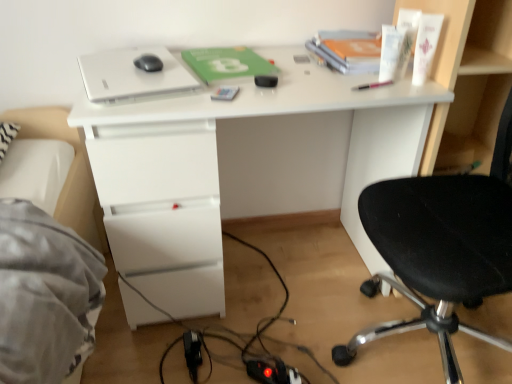
Where is `white matte book at upper right`? This screenshot has width=512, height=384. white matte book at upper right is located at coordinates (348, 50).

Locate an element on the screen. white glossy desk at center is located at coordinates (240, 166).

Identify the location of black fabric chair at right. (441, 248).

Measure the distance between black fabric chair at right and camera.

black fabric chair at right is 32.70 inches from camera.

Image resolution: width=512 pixels, height=384 pixels. What do you see at coordinates (225, 93) in the screenshot? I see `metallic silver phone at center, the first stationery from the left` at bounding box center [225, 93].

Locate an element on the screen. The width and height of the screenshot is (512, 384). pink plastic pen at upper right, which is the second stationery from left to right is located at coordinates (373, 85).

The image size is (512, 384). What do you see at coordinates (373, 85) in the screenshot? I see `pink plastic pen at upper right, positioned as the 1th stationery in right-to-left order` at bounding box center [373, 85].

In order to click on black matte mouse at upper center in this screenshot , I will do `click(148, 63)`.

Image resolution: width=512 pixels, height=384 pixels. I want to click on white matte book at upper right, so click(x=348, y=50).

Is white matte laptop at upper center in front of or behind metallic silver phone at center, positioned as the 2th stationery in right-to-left order, in the image?

Visually, white matte laptop at upper center is located in front of metallic silver phone at center, positioned as the 2th stationery in right-to-left order.

Between point (150, 54) and point (230, 95), which one is positioned in front?

The point (230, 95) is in front.

Considering the sizes of objects white matte laptop at upper center and metallic silver phone at center, positioned as the 2th stationery in right-to-left order, in the image provided, who is bigger, white matte laptop at upper center or metallic silver phone at center, positioned as the 2th stationery in right-to-left order,?

white matte laptop at upper center is bigger.

What's the angular difference between white matte laptop at upper center and metallic silver phone at center, the first stationery from the left,'s facing directions?

34.7 degrees separate the facing orientations of white matte laptop at upper center and metallic silver phone at center, the first stationery from the left.

How many degrees apart are the facing directions of black matte mouse at upper center and green matte paperback book at center?

The angle between the facing direction of black matte mouse at upper center and the facing direction of green matte paperback book at center is 15.2 degrees.

Is black matte mouse at upper center shorter than green matte paperback book at center?

No.

Is black matte mouse at upper center spatially inside green matte paperback book at center, or outside of it?

black matte mouse at upper center cannot be found inside green matte paperback book at center.

From the image's perspective, is black matte mouse at upper center positioned above or below green matte paperback book at center?

From the image's perspective, black matte mouse at upper center appears below green matte paperback book at center.

From the picture: Considering the relative sizes of black fabric chair at right and black matte mouse at upper center in the image provided, is black fabric chair at right bigger than black matte mouse at upper center?

Yes, black fabric chair at right is bigger than black matte mouse at upper center.

Is black fabric chair at right completely or partially outside of black matte mouse at upper center?

black fabric chair at right lies outside black matte mouse at upper center's area.

Which is nearer, [511,120] or [162,66]?

Positioned in front is point [511,120].

From the image's perspective, between pink plastic pen at upper right, positioned as the 1th stationery in right-to-left order, and white glossy desk at center, which one is located above?

pink plastic pen at upper right, positioned as the 1th stationery in right-to-left order.

Is pink plastic pen at upper right, positioned as the 1th stationery in right-to-left order, facing away from white glossy desk at center?

That's right, pink plastic pen at upper right, positioned as the 1th stationery in right-to-left order, is facing away from white glossy desk at center.

Considering the positions of objects pink plastic pen at upper right, positioned as the 1th stationery in right-to-left order, and white glossy desk at center in the image provided, who is behind, pink plastic pen at upper right, positioned as the 1th stationery in right-to-left order, or white glossy desk at center?

pink plastic pen at upper right, positioned as the 1th stationery in right-to-left order, is behind.

Looking at their sizes, would you say pink plastic pen at upper right, positioned as the 1th stationery in right-to-left order, is wider or thinner than white glossy desk at center?

pink plastic pen at upper right, positioned as the 1th stationery in right-to-left order, is thinner than white glossy desk at center.

Find the location of a particular element. paperback book located above the white glossy desk at center (from a real-world perspective) is located at coordinates (227, 63).

Is white glossy desk at center at the back of green matte paperback book at center?

Absolutely, green matte paperback book at center is directed away from white glossy desk at center.

How far apart are green matte paperback book at center and white glossy desk at center?

green matte paperback book at center and white glossy desk at center are 14.07 inches apart from each other.

Can we say green matte paperback book at center lies outside white glossy desk at center?

No, green matte paperback book at center is inside or overlapping with white glossy desk at center.

Is black fabric chair at right completely or partially outside of white glossy desk at center?

Yes, black fabric chair at right is outside of white glossy desk at center.

Does black fabric chair at right have a greater height compared to white glossy desk at center?

Yes.

From a real-world perspective, is black matte mouse at upper center physically located above or below white glossy desk at center?

black matte mouse at upper center is situated higher than white glossy desk at center in the real world.

Can white glossy desk at center be found inside black matte mouse at upper center?

No.

Consider the image. Does black matte mouse at upper center have a greater width compared to white glossy desk at center?

No.

I want to click on laptop that is on the left side of metallic silver phone at center, the first stationery from the left, so [x=133, y=74].

This screenshot has width=512, height=384. Identify the location of mouse that is above the green matte paperback book at center (from a real-world perspective). (148, 63).

When comparing their distances from white matte book at upper right, does black matte mouse at upper center or black fabric chair at right seem further?

The object further to white matte book at upper right is black matte mouse at upper center.

Based on their spatial positions, is black fabric chair at right or black matte mouse at upper center closer to white matte laptop at upper center?

The object closer to white matte laptop at upper center is black matte mouse at upper center.

Based on their spatial positions, is green matte paperback book at center or black matte mouse at upper center further from white matte book at upper right?

Among the two, black matte mouse at upper center is located further to white matte book at upper right.

Looking at the image, which one is located further to pink plastic pen at upper right, which is the second stationery from left to right, white glossy desk at center or green matte paperback book at center?

The object further to pink plastic pen at upper right, which is the second stationery from left to right, is white glossy desk at center.

Consider the image. From the image, which object appears to be farther from white matte book at upper right, green matte paperback book at center or white matte laptop at upper center?

white matte laptop at upper center is positioned further to the anchor white matte book at upper right.

When comparing their distances from black matte mouse at upper center, does white matte laptop at upper center or white matte book at upper right seem further?

Among the two, white matte book at upper right is located further to black matte mouse at upper center.

Based on their spatial positions, is metallic silver phone at center, the first stationery from the left, or green matte paperback book at center closer to pink plastic pen at upper right, positioned as the 1th stationery in right-to-left order?

The object closer to pink plastic pen at upper right, positioned as the 1th stationery in right-to-left order, is metallic silver phone at center, the first stationery from the left.

Estimate the real-world distances between objects in this image. Which object is further from pink plastic pen at upper right, positioned as the 1th stationery in right-to-left order, metallic silver phone at center, the first stationery from the left, or white glossy desk at center?

Based on the image, white glossy desk at center appears to be further to pink plastic pen at upper right, positioned as the 1th stationery in right-to-left order.

Locate an element on the screen. The height and width of the screenshot is (384, 512). mouse situated between white matte laptop at upper center and green matte paperback book at center from left to right is located at coordinates (148, 63).

The width and height of the screenshot is (512, 384). Find the location of `paperback book between black fabric chair at right and white matte book at upper right from front to back`. paperback book between black fabric chair at right and white matte book at upper right from front to back is located at coordinates 227,63.

Locate an element on the screen. The height and width of the screenshot is (384, 512). laptop between green matte paperback book at center and white glossy desk at center vertically is located at coordinates (133, 74).

This screenshot has width=512, height=384. I want to click on desk between black fabric chair at right and pink plastic pen at upper right, which is the second stationery from left to right, from front to back, so 240,166.